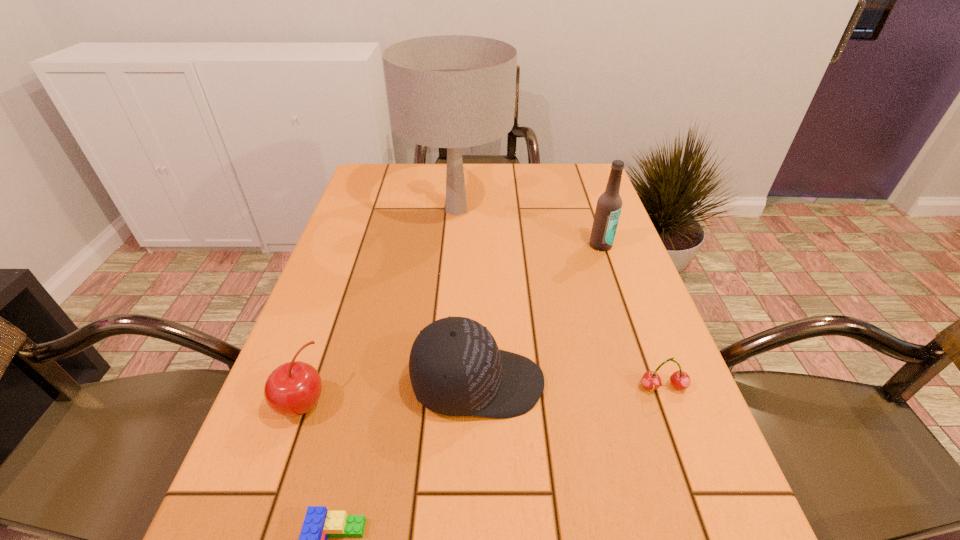
I want to click on free space at the far right corner, so click(559, 174).

The height and width of the screenshot is (540, 960). Identify the location of free space that is in between the second shortest object and the lampshade. (560, 298).

Find the location of `free area in between the tallest object and the fifth shortest object`. free area in between the tallest object and the fifth shortest object is located at coordinates (529, 227).

Locate an element on the screen. The height and width of the screenshot is (540, 960). free space between the baseball cap and the beer bottle is located at coordinates (540, 314).

Image resolution: width=960 pixels, height=540 pixels. In order to click on vacant space that is in between the third shortest object and the tallest object in this screenshot , I will do `click(379, 306)`.

Locate an element on the screen. unoccupied area between the fifth shortest object and the right cherry is located at coordinates (632, 316).

Locate an element on the screen. The width and height of the screenshot is (960, 540). object that is the fifth closest to the fifth shortest object is located at coordinates (319, 524).

What are the coordinates of `object that is the second closest one to the right cherry` in the screenshot? It's located at (608, 209).